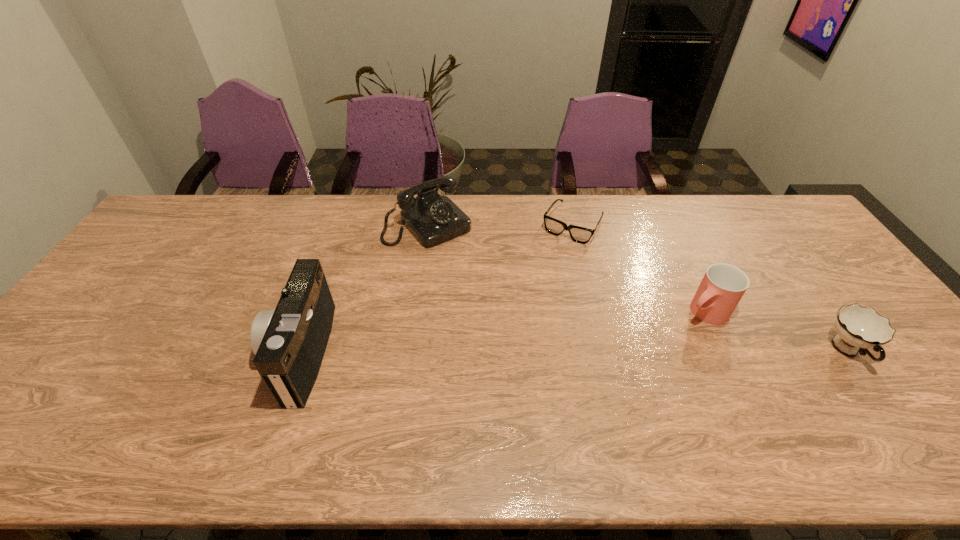
This screenshot has height=540, width=960. I want to click on vacant region located 0.390m on the lens of the tallest object, so click(119, 353).

Find the location of a particular element. vacant space located on the lens of the tallest object is located at coordinates (241, 353).

Find the location of a particular element. Image resolution: width=960 pixels, height=540 pixels. free region located on the side of the second shortest object with the handle is located at coordinates click(x=879, y=395).

Locate an element on the screen. The height and width of the screenshot is (540, 960). vacant space situated on the dial of the second object from left to right is located at coordinates (500, 299).

The image size is (960, 540). What are the coordinates of `vacant space located 0.340m on the dial of the second object from left to right` in the screenshot? It's located at (513, 312).

Where is `free space located on the dial of the second object from left to right`? free space located on the dial of the second object from left to right is located at coordinates (489, 286).

The image size is (960, 540). I want to click on vacant space situated on the front-facing side of the sunglasses, so click(x=554, y=254).

Locate an element on the screen. blank space located 0.100m on the front-facing side of the sunglasses is located at coordinates (549, 262).

You are a GUI agent. You are given a task and a screenshot of the screen. Output one action in this format:
    pyautogui.click(x=<x>, y=<y>)
    Task: Click on the free space located on the front-facing side of the sunglasses
    This screenshot has height=540, width=960.
    Given the screenshot: What is the action you would take?
    pyautogui.click(x=554, y=254)

You are a GUI agent. You are given a task and a screenshot of the screen. Output one action in this format:
    pyautogui.click(x=<x>, y=<y>)
    Task: Click on the vacant region located on the side of the left cup with the handle
    Image resolution: width=960 pixels, height=540 pixels.
    Given the screenshot: What is the action you would take?
    pyautogui.click(x=618, y=373)